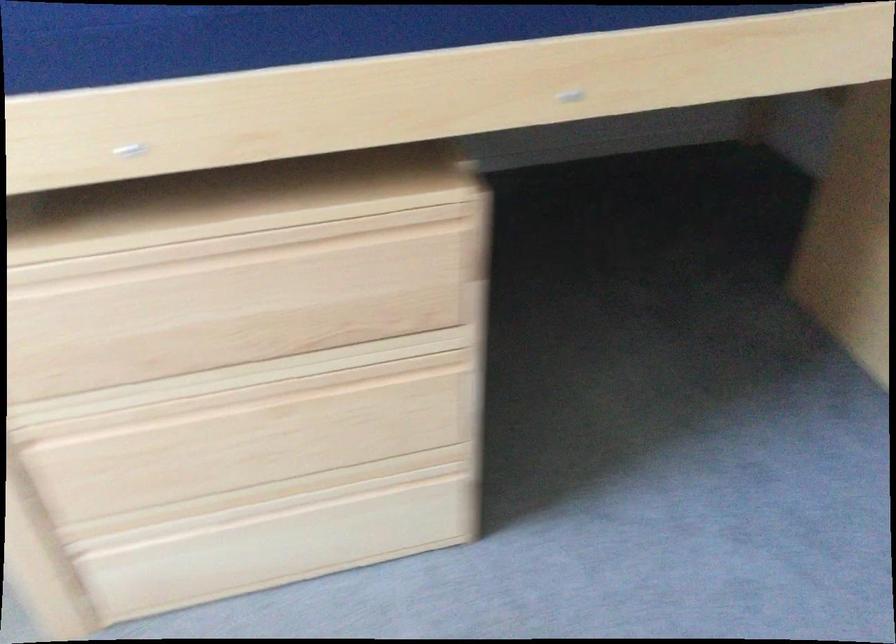
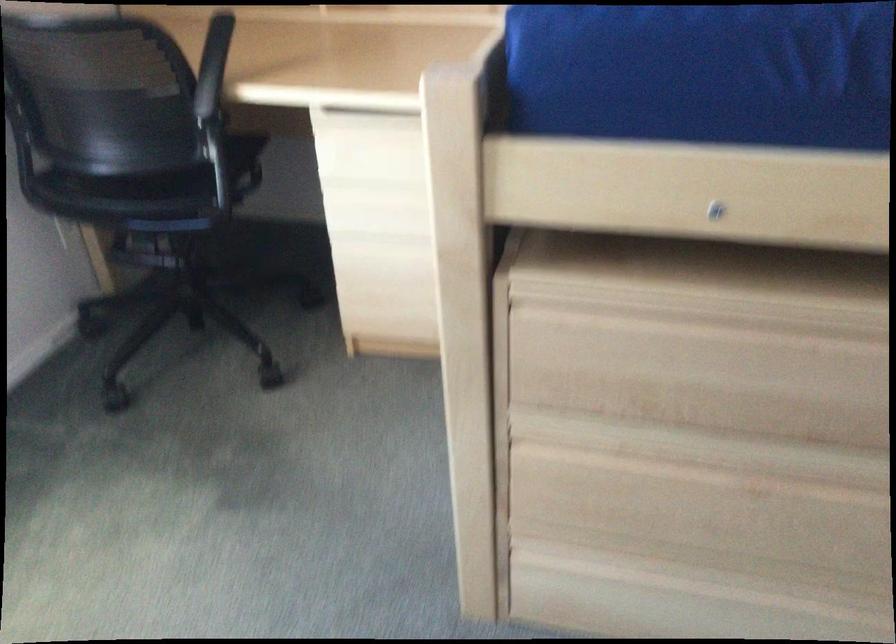
Find the pixel in the second image that matches point 287,498 in the first image.

(705, 582)